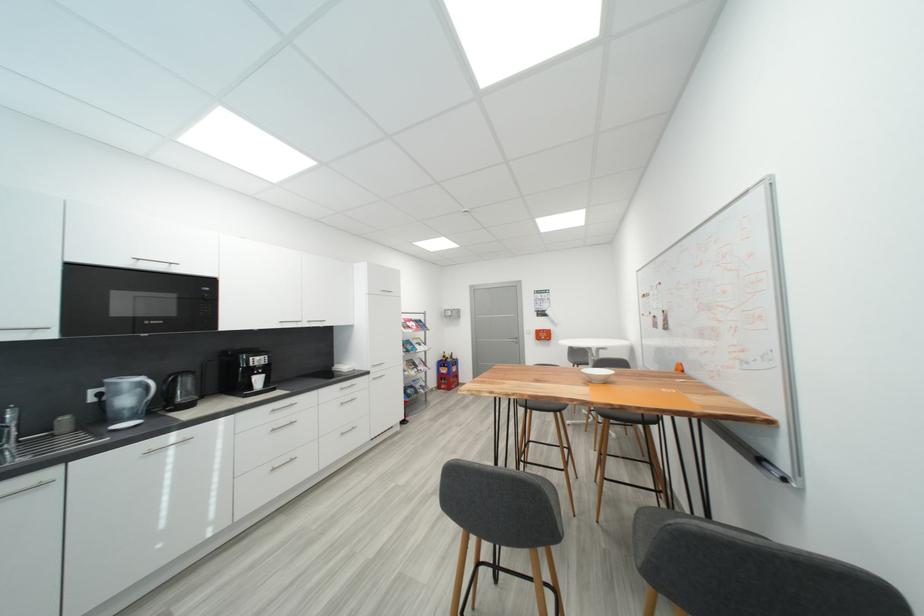
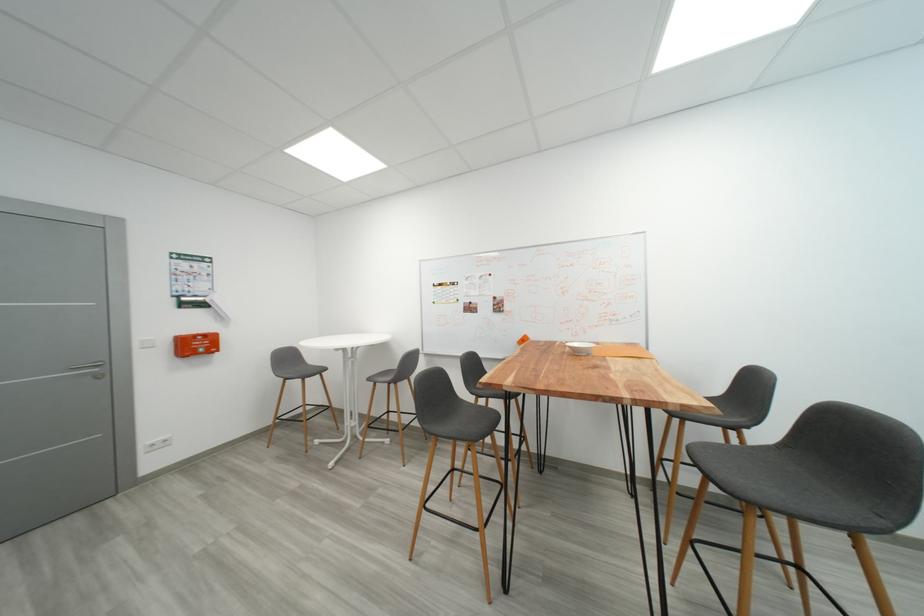
Where in the second image is the point corresponding to (x=551, y=338) from the first image?

(203, 347)